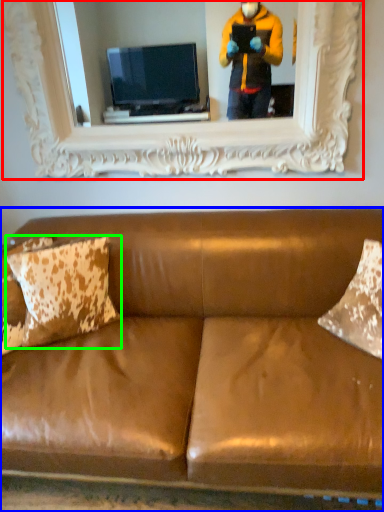
Question: Estimate the real-world distances between objects in this image. Which object is farther from picture frame (highlighted by a red box), studio couch (highlighted by a blue box) or pillow (highlighted by a green box)?

Choices:
 (A) studio couch
 (B) pillow

Answer: (A)